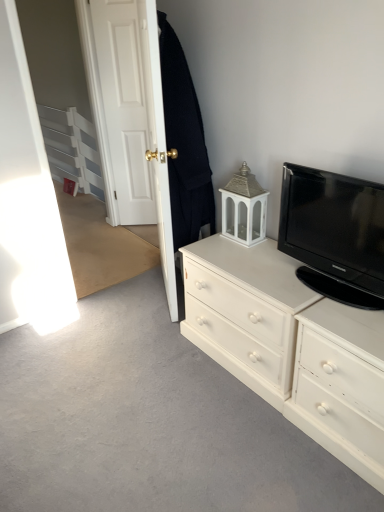
Locate an element on the screen. The width and height of the screenshot is (384, 512). vacant region in front of white wood door at upper left, which is counted as the first door, starting from the left is located at coordinates (132, 233).